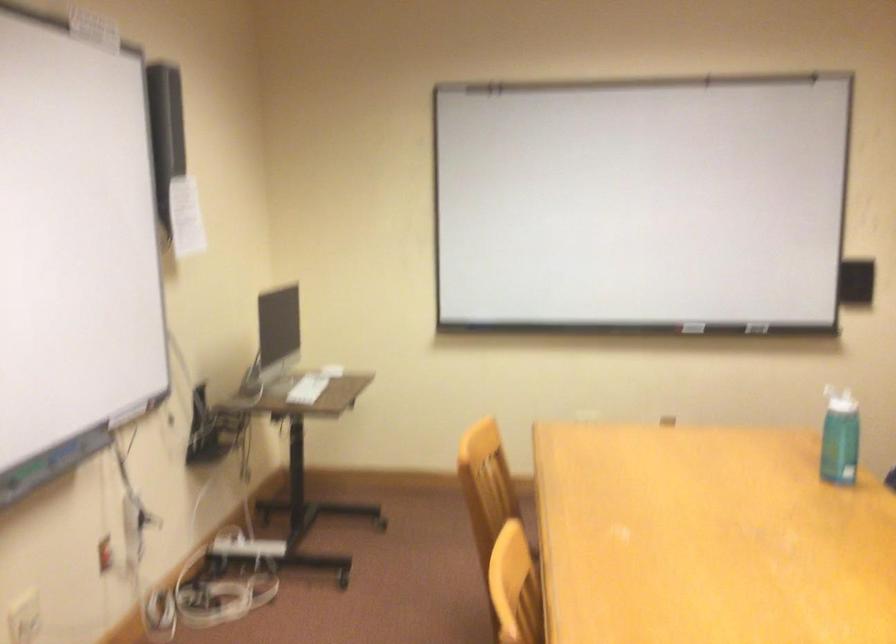
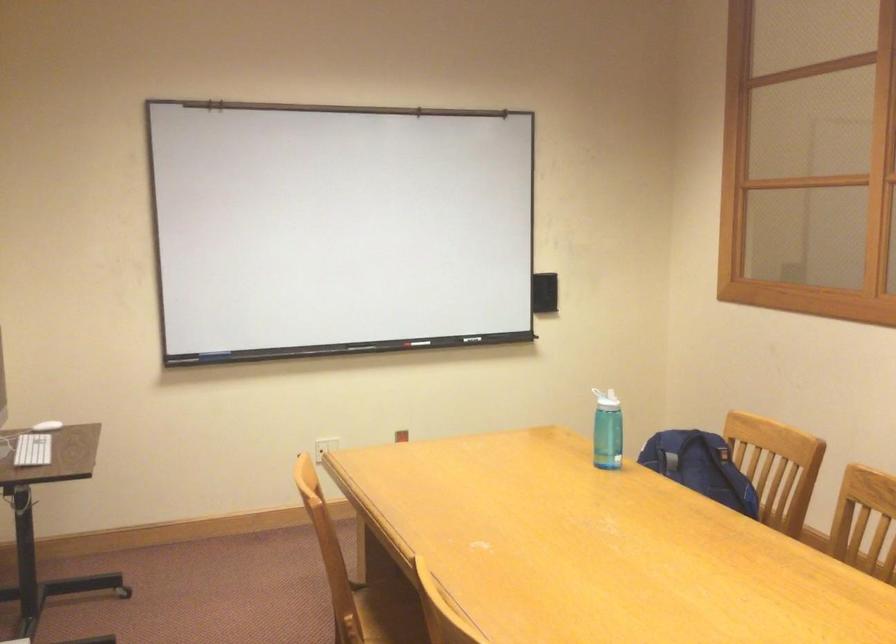
Find the pixel in the second image that matches pixel 736 333 in the first image.

(420, 343)